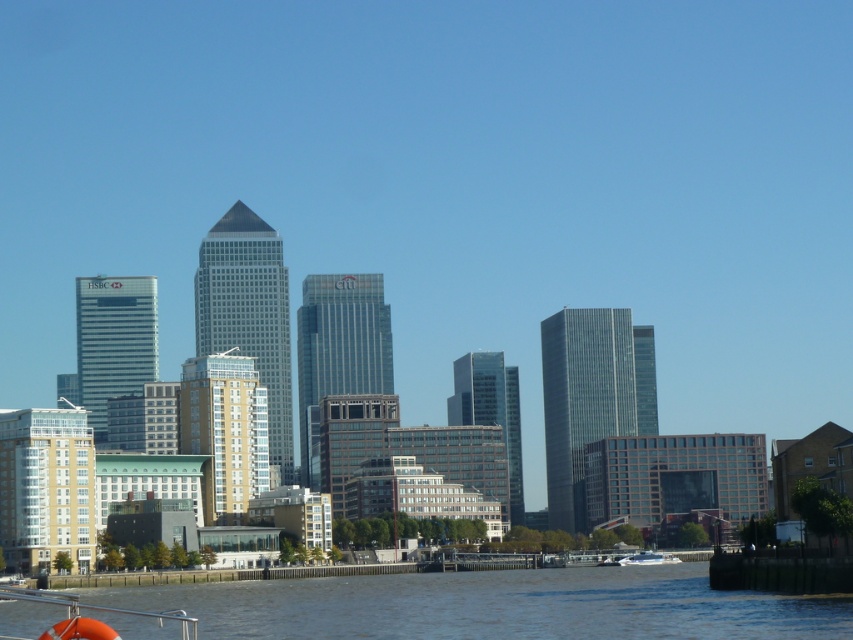
Is brown water at lower center bigger than white glossy boat at lower center?

Yes, brown water at lower center is bigger than white glossy boat at lower center.

Locate an element on the screen. The image size is (853, 640). brown water at lower center is located at coordinates (492, 605).